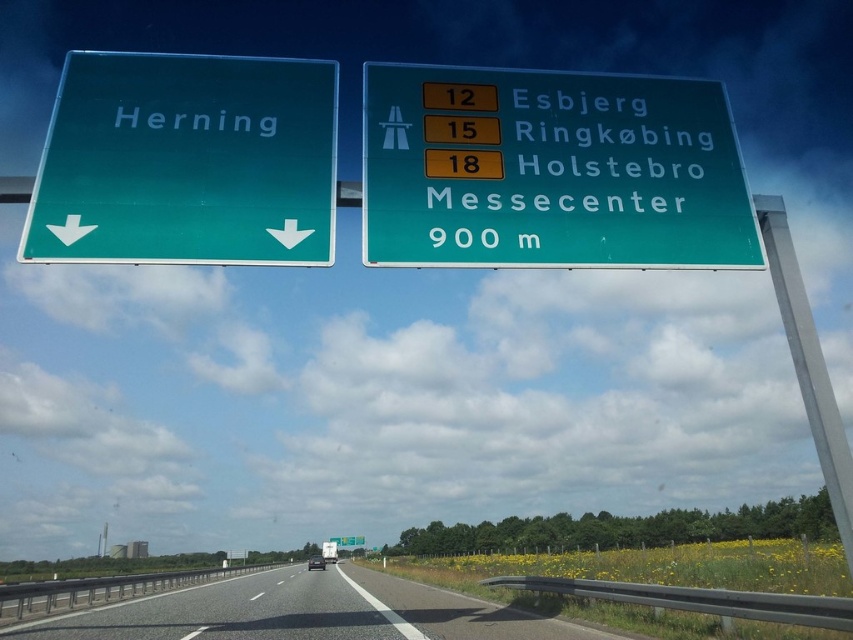
You are a driver approaching the green glossy signboard at upper center and the asphalt road at center. Which object appears taller in the image?

The asphalt road at center appears taller than the green glossy signboard at upper center because the signboard is not as tall as the road.